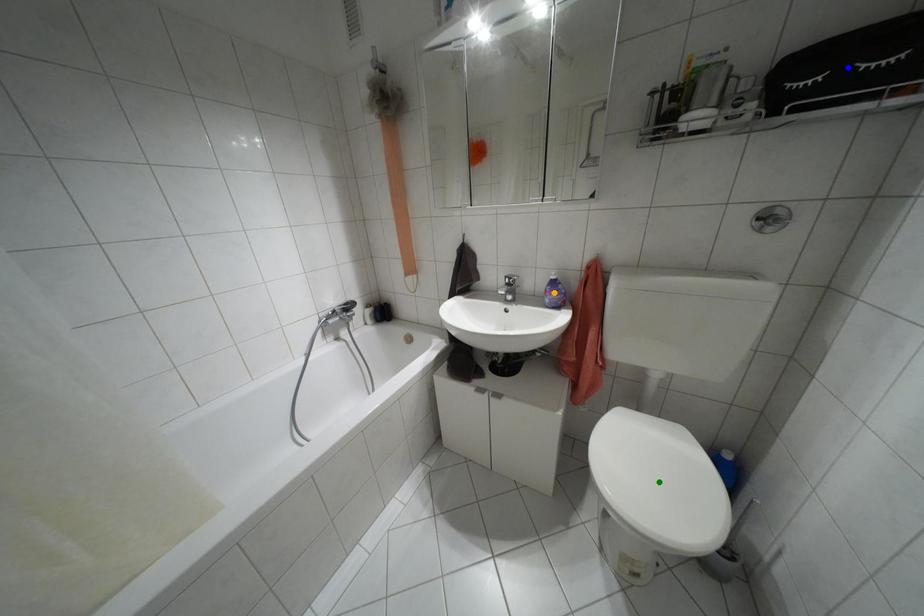
Order these from nearest to farthest:
blue point, orange point, green point

blue point, green point, orange point